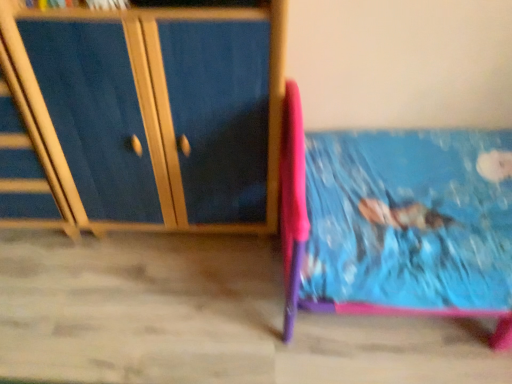
You are a GUI agent. You are given a task and a screenshot of the screen. Output one action in this format:
    pyautogui.click(x=<x>, y=<y>)
    Task: Click on the free location in front of blue wood cabinet at left
    This screenshot has height=384, width=512.
    Given the screenshot: What is the action you would take?
    pyautogui.click(x=148, y=313)